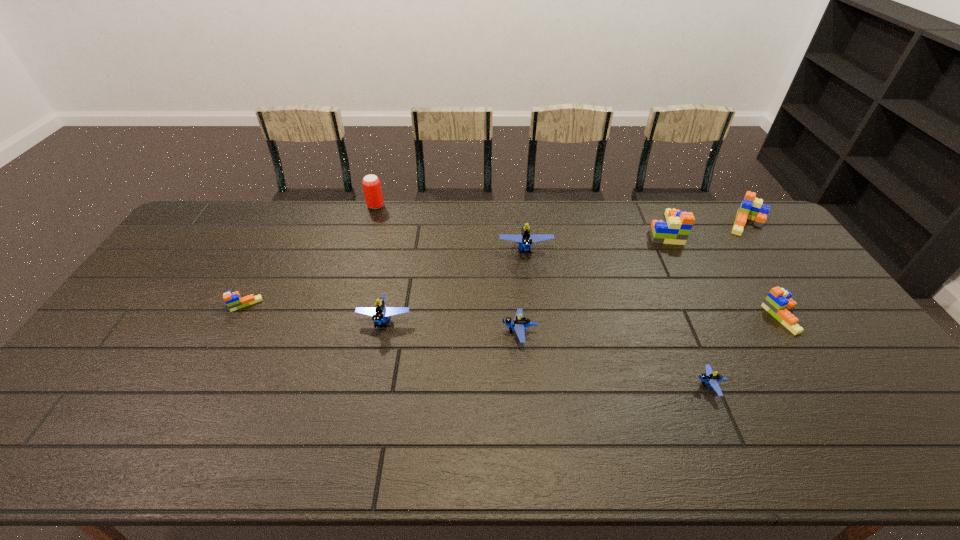
I want to click on red beer can, so click(371, 184).

Image resolution: width=960 pixels, height=540 pixels. I want to click on beer can, so click(x=371, y=184).

In order to click on the third orange Lego from right to left in this screenshot , I will do `click(676, 230)`.

Locate an element on the screen. This screenshot has width=960, height=540. the farthest blue Lego is located at coordinates (525, 239).

Identify the location of the third smallest orange Lego. This screenshot has width=960, height=540. (751, 208).

Find the location of a particular element. This screenshot has height=540, width=960. the third object from left to right is located at coordinates (380, 314).

This screenshot has height=540, width=960. I want to click on the second Lego from left to right, so click(x=380, y=314).

Where is `the third biggest orange Lego`? the third biggest orange Lego is located at coordinates (778, 303).

Locate an element on the screen. the second smallest blue Lego is located at coordinates (520, 323).

Identify the location of the leftmost orange Lego. (233, 300).